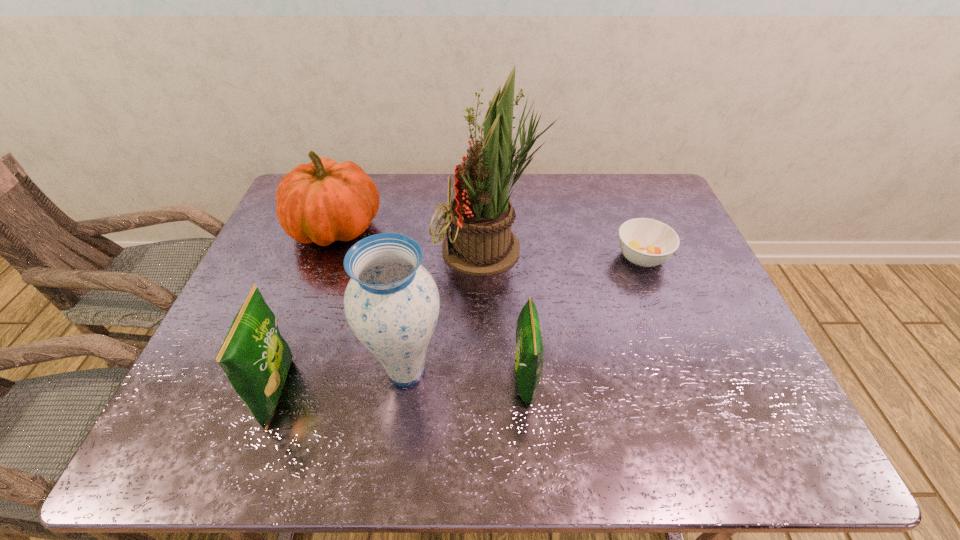
You are a GUI agent. You are given a task and a screenshot of the screen. Output one action in this format:
    pyautogui.click(x=<x>, y=<y>)
    Task: Click on the object located in the right edge section of the desktop
    The image size is (960, 540).
    Given the screenshot: What is the action you would take?
    pyautogui.click(x=645, y=242)

Where is `object that is at the far left corner`? object that is at the far left corner is located at coordinates (323, 201).

I want to click on object that is at the near left corner, so click(x=255, y=358).

In the image, there is a desktop. Find the location of `vacant space at the far edge`. vacant space at the far edge is located at coordinates [x=616, y=194].

Where is `free space at the near edge of the desktop`? free space at the near edge of the desktop is located at coordinates (369, 406).

Locate an element on the screen. The height and width of the screenshot is (540, 960). vacant space at the right edge of the desktop is located at coordinates (663, 287).

Locate an element on the screen. The image size is (960, 540). blank space at the far right corner of the desktop is located at coordinates (635, 214).

Find the location of a particular element. The image size is (960, 540). vacant space in between the soup bowl and the tallest object is located at coordinates (566, 253).

The height and width of the screenshot is (540, 960). What are the coordinates of `free space between the shorter crisp (potato chip) and the second tallest object` in the screenshot? It's located at (466, 375).

You are a GUI agent. You are given a task and a screenshot of the screen. Output one action in this format:
    pyautogui.click(x=<x>, y=<y>)
    Task: Click on the free space between the shorter crisp (potato chip) and the vase
    
    Given the screenshot: What is the action you would take?
    pyautogui.click(x=466, y=375)